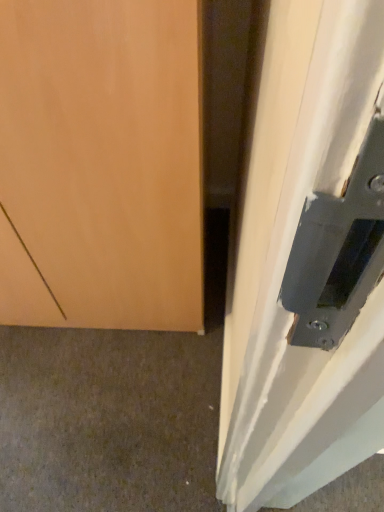
What do you see at coordinates (108, 420) in the screenshot? This screenshot has width=384, height=512. I see `brown matte door at upper left` at bounding box center [108, 420].

You are a GUI agent. You are given a task and a screenshot of the screen. Output one action in this format:
    pyautogui.click(x=<x>, y=<y>)
    Task: Click on the brown matte door at upper left
    
    Given the screenshot: What is the action you would take?
    pyautogui.click(x=108, y=420)

Locate an element on the screen. brown matte door at upper left is located at coordinates (108, 420).